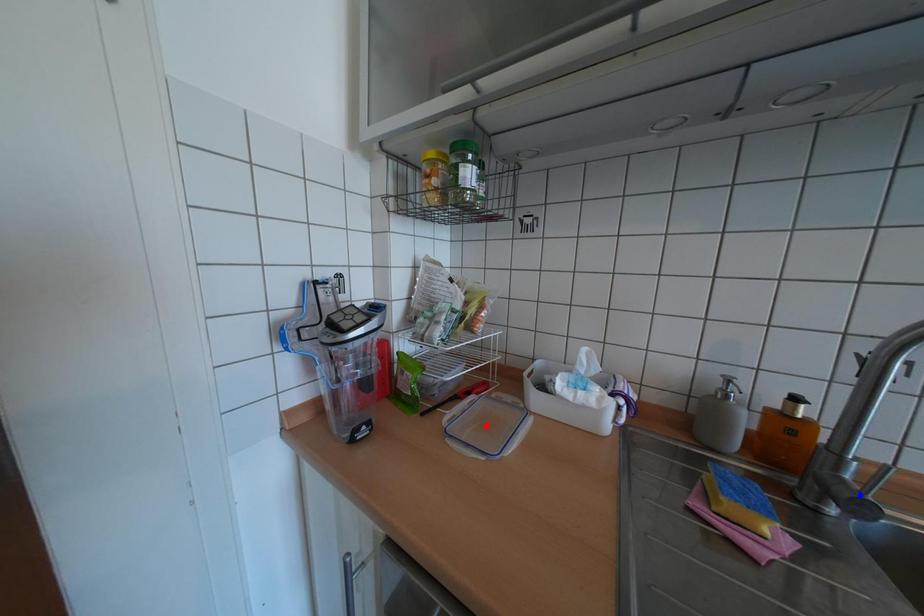
Question: Which of the two points in the image is closer to the camera?

Choices:
 (A) Blue point is closer.
 (B) Red point is closer.

Answer: (A)